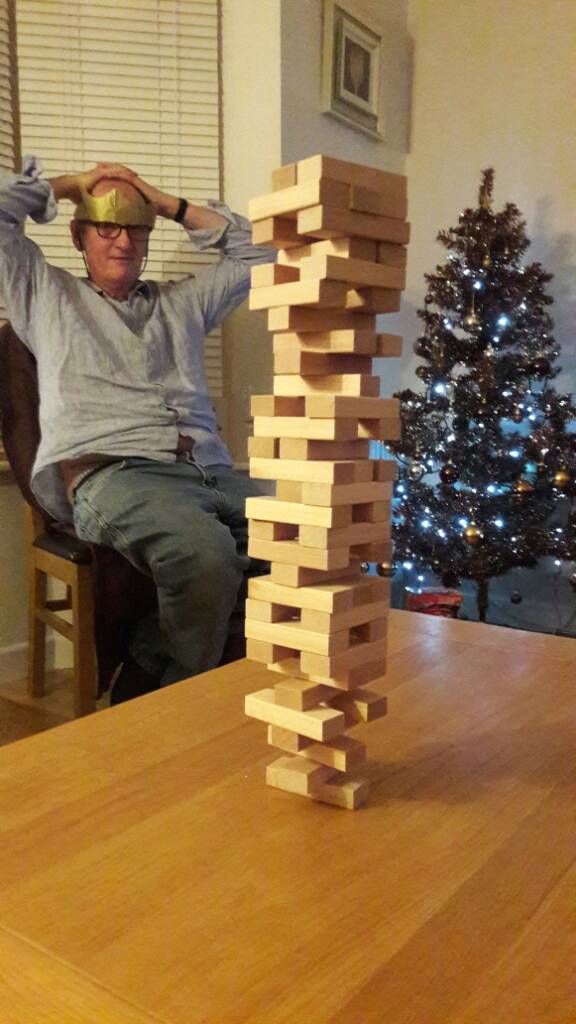
At what (x,y) coordinates should I click in order to perform the action: click on christmas tree. Please return your answer as a coordinate pair (x, y). Looking at the image, I should click on (454, 428).